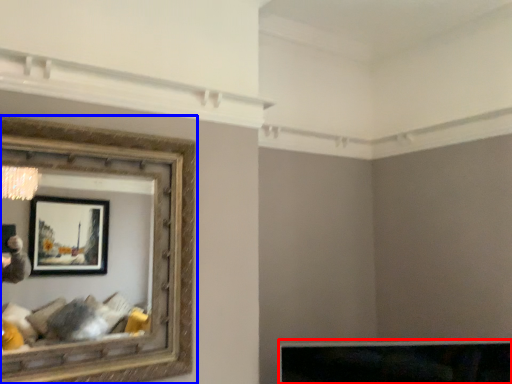
Question: Which of the following is the closest to the observer, furniture (highlighted by a red box) or picture frame (highlighted by a blue box)?

Choices:
 (A) furniture
 (B) picture frame

Answer: (B)